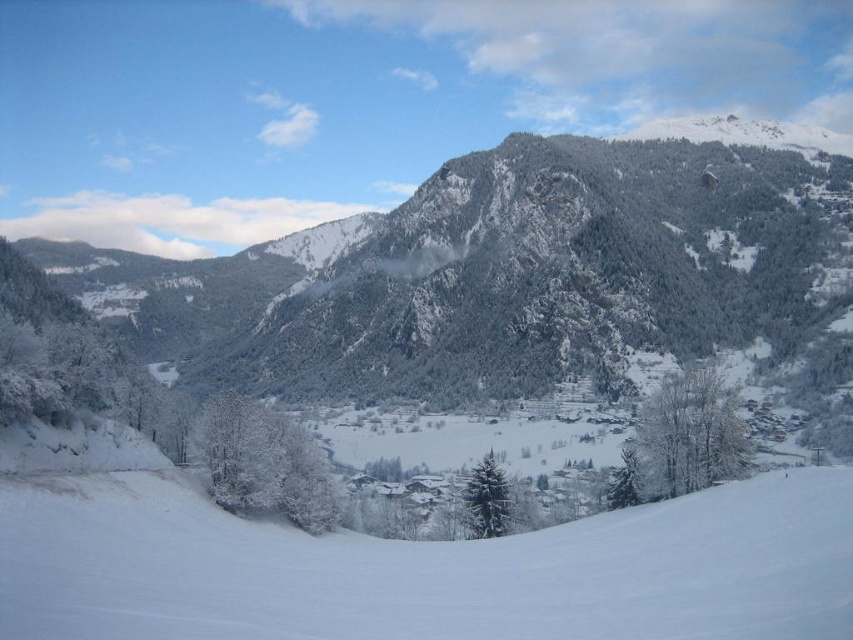
Question: Is green textured mountain at center positioned in front of white frosty tree at center?

Choices:
 (A) yes
 (B) no

Answer: (B)

Question: Which point is farther to the camera?

Choices:
 (A) (56, 272)
 (B) (694, 426)
 (C) (311, 444)

Answer: (A)

Question: Which of these objects is positioned farthest from the green textured mountain at center?

Choices:
 (A) green matte tree at center
 (B) white snow ski slope at center

Answer: (B)

Question: Is green textured mountain at center below green matte tree at center?

Choices:
 (A) yes
 (B) no

Answer: (B)

Question: Which object appears closest to the camera in this image?

Choices:
 (A) green matte tree at center
 (B) white snow ski slope at center
 (C) white frosty tree at center

Answer: (B)

Question: Does white snow ski slope at center appear under white frosty tree at lower right?

Choices:
 (A) yes
 (B) no

Answer: (A)